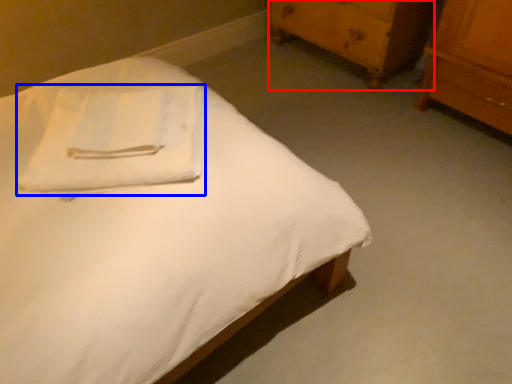
Question: Which point is further to the camera, chest of drawers (highlighted by a red box) or cloth (highlighted by a blue box)?

Choices:
 (A) chest of drawers
 (B) cloth

Answer: (A)